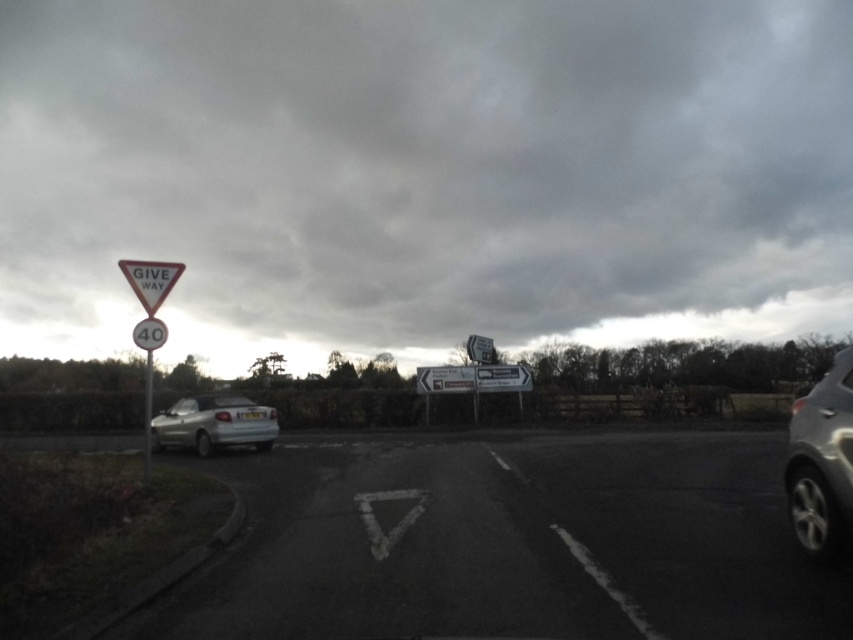
You are a delivery driver who needs to park your van in the black asphalt parking lot at center. The van is 2 meters wide. The matte metal speed limit sign at left is on the side of the road. Can the van fit into the parking lot without hitting the sign?

The black asphalt parking lot at center is wider than the matte metal speed limit sign at left, so the van can fit into the parking lot without hitting the sign since its width surpasses the sign.

You are standing at the intersection and need to reach a specific point marked at coordinates point (445, 566). If your vision is limited to 10 meters, can you see this point clearly?

The distance of point (445, 566) from viewer is 6.25 meters, so yes, you can see this point clearly as it is within your 10 meters visibility range.

You are a driver approaching the intersection and need to know which traffic sign is wider to better judge your distance. Which is wider between the white plastic triangle at left and the matte metal speed limit sign at left?

The white plastic triangle at left is wider than the matte metal speed limit sign at left according to the description.